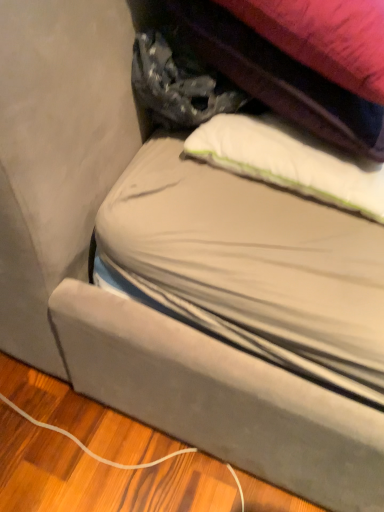
What do you see at coordinates (271, 72) in the screenshot?
I see `textured fabric bag at upper center` at bounding box center [271, 72].

This screenshot has width=384, height=512. What are the coordinates of `textured fabric bag at upper center` in the screenshot? It's located at pyautogui.click(x=271, y=72).

This screenshot has width=384, height=512. Describe the element at coordinates (290, 161) in the screenshot. I see `white soft pillow at upper center` at that location.

What are the coordinates of `white soft pillow at upper center` in the screenshot? It's located at (290, 161).

In order to face white soft pillow at upper center, should I rotate leftwards or rightwards?

Turn right by 18.754 degrees to look at white soft pillow at upper center.

The image size is (384, 512). I want to click on textured fabric bag at upper center, so click(x=271, y=72).

Does white soft pillow at upper center appear on the left side of textured fabric bag at upper center?

No, white soft pillow at upper center is not to the left of textured fabric bag at upper center.

Considering their positions, is white soft pillow at upper center located in front of or behind textured fabric bag at upper center?

Visually, white soft pillow at upper center is located behind textured fabric bag at upper center.

Which is behind, point (375, 165) or point (241, 82)?

The point (241, 82) is farther.

From the image's perspective, which object appears higher, white soft pillow at upper center or textured fabric bag at upper center?

textured fabric bag at upper center, from the image's perspective.

From a real-world perspective, who is located lower, white soft pillow at upper center or textured fabric bag at upper center?

white soft pillow at upper center.

Which of these two, white soft pillow at upper center or textured fabric bag at upper center, is thinner?

white soft pillow at upper center is thinner.

Which of these two, white soft pillow at upper center or textured fabric bag at upper center, stands shorter?

Standing shorter between the two is white soft pillow at upper center.

Can you confirm if white soft pillow at upper center is smaller than textured fabric bag at upper center?

Yes.

Is white soft pillow at upper center located outside textured fabric bag at upper center?

Yes, white soft pillow at upper center is outside of textured fabric bag at upper center.

Would you say white soft pillow at upper center is a long distance from textured fabric bag at upper center?

No, white soft pillow at upper center is not far from textured fabric bag at upper center.

Could you tell me if white soft pillow at upper center is turned towards textured fabric bag at upper center?

No, white soft pillow at upper center is not aimed at textured fabric bag at upper center.

How different are the orientations of white soft pillow at upper center and textured fabric bag at upper center in degrees?

They differ by 1.27 degrees in their facing directions.

How far apart are white soft pillow at upper center and textured fabric bag at upper center?

white soft pillow at upper center is 2.92 inches from textured fabric bag at upper center.

Image resolution: width=384 pixels, height=512 pixels. I want to click on bag that is above the white soft pillow at upper center (from a real-world perspective), so click(x=271, y=72).

Considering the relative positions of textured fabric bag at upper center and white soft pillow at upper center in the image provided, is textured fabric bag at upper center to the right of white soft pillow at upper center from the viewer's perspective?

No, textured fabric bag at upper center is not to the right of white soft pillow at upper center.

Is the position of textured fabric bag at upper center more distant than that of white soft pillow at upper center?

No, textured fabric bag at upper center is closer to the camera.

Is point (313, 59) closer or farther from the camera than point (267, 182)?

Point (313, 59) appears to be closer to the viewer than point (267, 182).

Consider the image. From the image's perspective, which is above, textured fabric bag at upper center or white soft pillow at upper center?

textured fabric bag at upper center.

From a real-world perspective, is textured fabric bag at upper center above or below white soft pillow at upper center?

textured fabric bag at upper center is above white soft pillow at upper center.

Considering the sizes of textured fabric bag at upper center and white soft pillow at upper center in the image, is textured fabric bag at upper center wider or thinner than white soft pillow at upper center?

Considering their sizes, textured fabric bag at upper center looks broader than white soft pillow at upper center.

Looking at this image, which of these two, textured fabric bag at upper center or white soft pillow at upper center, stands shorter?

Standing shorter between the two is white soft pillow at upper center.

Which of these two, textured fabric bag at upper center or white soft pillow at upper center, is smaller?

white soft pillow at upper center is smaller.

Is textured fabric bag at upper center outside of white soft pillow at upper center?

That's correct, textured fabric bag at upper center is outside of white soft pillow at upper center.

Are textured fabric bag at upper center and white soft pillow at upper center making contact?

Yes, textured fabric bag at upper center is touching white soft pillow at upper center.

Is textured fabric bag at upper center turned away from white soft pillow at upper center?

No, textured fabric bag at upper center is not facing the opposite direction of white soft pillow at upper center.

Locate an element on the screen. The image size is (384, 512). pillow behind the textured fabric bag at upper center is located at coordinates (290, 161).

This screenshot has width=384, height=512. What are the coordinates of `pillow below the textured fabric bag at upper center (from a real-world perspective)` in the screenshot? It's located at (290, 161).

Find the location of a particular element. The image size is (384, 512). bag that appears in front of the white soft pillow at upper center is located at coordinates coord(271,72).